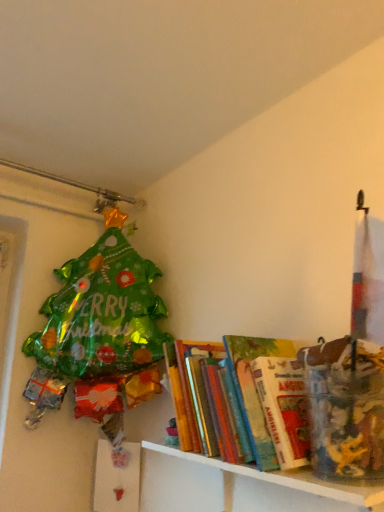
Question: Is white glossy shelf at lower right at the right side of hardcover books at center?

Choices:
 (A) yes
 (B) no

Answer: (A)

Question: From a real-world perspective, is white glossy shelf at lower right below hardcover books at center?

Choices:
 (A) no
 (B) yes

Answer: (B)

Question: Is white glossy shelf at lower right located outside hardcover books at center?

Choices:
 (A) no
 (B) yes

Answer: (B)

Question: Can you confirm if white glossy shelf at lower right is smaller than hardcover books at center?

Choices:
 (A) yes
 (B) no

Answer: (B)

Question: Is white glossy shelf at lower right next to hardcover books at center?

Choices:
 (A) no
 (B) yes

Answer: (A)

Question: Is white glossy shelf at lower right turned away from hardcover books at center?

Choices:
 (A) no
 (B) yes

Answer: (A)

Question: Could white glossy shelf at lower right be considered to be inside hardcover books at center?

Choices:
 (A) no
 (B) yes

Answer: (A)

Question: Is hardcover books at center bigger than white glossy shelf at lower right?

Choices:
 (A) no
 (B) yes

Answer: (A)

Question: Is hardcover books at center oriented away from white glossy shelf at lower right?

Choices:
 (A) yes
 (B) no

Answer: (B)

Question: Can you confirm if hardcover books at center is shorter than white glossy shelf at lower right?

Choices:
 (A) yes
 (B) no

Answer: (B)

Question: From the image's perspective, does hardcover books at center appear higher than white glossy shelf at lower right?

Choices:
 (A) no
 (B) yes

Answer: (B)

Question: From a real-world perspective, is hardcover books at center on white glossy shelf at lower right?

Choices:
 (A) yes
 (B) no

Answer: (A)

Question: From a real-world perspective, is white glossy shelf at lower right above or below hardcover books at center?

Choices:
 (A) below
 (B) above

Answer: (A)